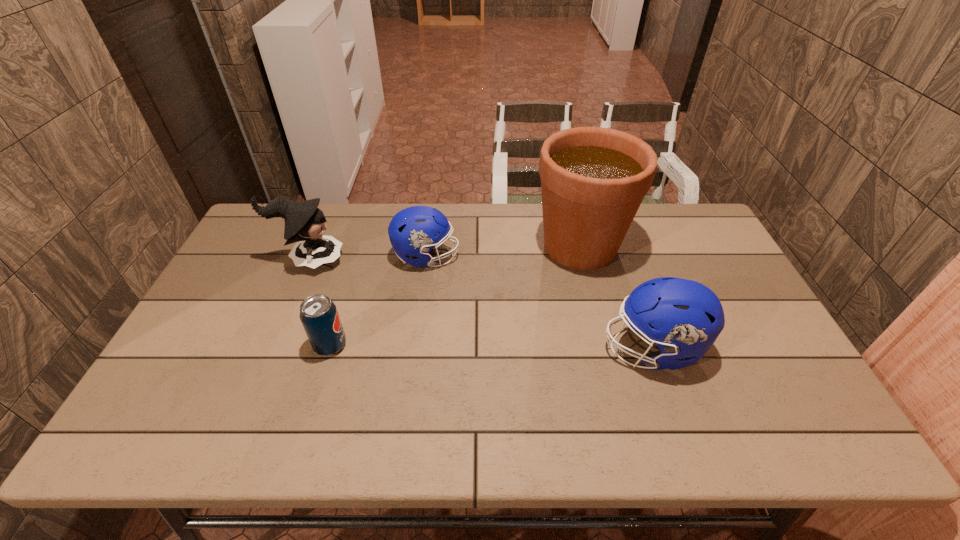
I want to click on empty space that is in between the tallest object and the doll, so click(x=444, y=253).

Find the location of a particular element. The height and width of the screenshot is (540, 960). free spot between the doll and the farther football helmet is located at coordinates (368, 258).

The image size is (960, 540). In order to click on object that is the second closest to the right football helmet in this screenshot , I will do `click(413, 231)`.

Where is `object that is the nearest to the doll`? The height and width of the screenshot is (540, 960). object that is the nearest to the doll is located at coordinates [413, 231].

In order to click on free spot that satisfies the following two spatial constraints: 1. on the back side of the tallest object; 2. on the right side of the shortest object in this screenshot , I will do `click(360, 247)`.